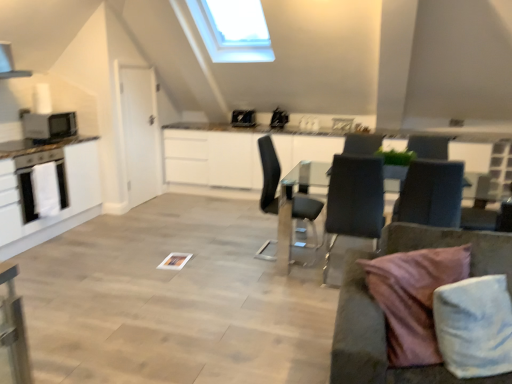
Question: Does satin black laptop at upper center, which ranks as the second appliance in back-to-front order, appear on the left side of black leather chair at center, the 1th chair viewed from the left?

Choices:
 (A) yes
 (B) no

Answer: (B)

Question: Is satin black laptop at upper center, marked as the 3th appliance in a left-to-right arrangement, behind black leather chair at center, which is the 3th chair in right-to-left order?

Choices:
 (A) no
 (B) yes

Answer: (B)

Question: Considering the relative sizes of satin black laptop at upper center, which appears as the 2th appliance when viewed from the front, and black leather chair at center, the 1th chair viewed from the left, in the image provided, is satin black laptop at upper center, which appears as the 2th appliance when viewed from the front, thinner than black leather chair at center, the 1th chair viewed from the left,?

Choices:
 (A) yes
 (B) no

Answer: (A)

Question: Is black leather chair at center, which is the 3th chair in right-to-left order, located within satin black laptop at upper center, which appears as the 2th appliance when viewed from the front?

Choices:
 (A) yes
 (B) no

Answer: (B)

Question: Considering the relative positions of satin black laptop at upper center, which appears as the 2th appliance when viewed from the front, and black leather chair at center, which is the 3th chair in right-to-left order, in the image provided, is satin black laptop at upper center, which appears as the 2th appliance when viewed from the front, in front of black leather chair at center, which is the 3th chair in right-to-left order,?

Choices:
 (A) no
 (B) yes

Answer: (A)

Question: Is satin black laptop at upper center, which ranks as the second appliance in back-to-front order, to the left or to the right of white glossy cabinetry at left in the image?

Choices:
 (A) left
 (B) right

Answer: (B)

Question: From a real-world perspective, is satin black laptop at upper center, which appears as the 2th appliance when viewed from the front, above or below white glossy cabinetry at left?

Choices:
 (A) above
 (B) below

Answer: (A)

Question: Is satin black laptop at upper center, which appears as the 2th appliance when viewed from the front, wider or thinner than white glossy cabinetry at left?

Choices:
 (A) wide
 (B) thin

Answer: (B)

Question: From the image's perspective, is satin black laptop at upper center, which appears as the 2th appliance when viewed from the front, positioned above or below white glossy cabinetry at left?

Choices:
 (A) below
 (B) above

Answer: (B)

Question: From the image's perspective, relative to white glossy oven at left, is white glossy sink at upper center above or below?

Choices:
 (A) above
 (B) below

Answer: (A)

Question: Is white glossy sink at upper center wider or thinner than white glossy oven at left?

Choices:
 (A) thin
 (B) wide

Answer: (B)

Question: From a real-world perspective, relative to white glossy oven at left, is white glossy sink at upper center vertically above or below?

Choices:
 (A) below
 (B) above

Answer: (B)

Question: Is white glossy sink at upper center inside or outside of white glossy oven at left?

Choices:
 (A) outside
 (B) inside

Answer: (A)

Question: Considering the positions of point (271, 117) and point (45, 137), is point (271, 117) closer or farther from the camera than point (45, 137)?

Choices:
 (A) farther
 (B) closer

Answer: (A)

Question: Is satin black laptop at upper center, which is the first appliance in right-to-left order, spatially inside matte black microwave at left, positioned as the 1th appliance in left-to-right order, or outside of it?

Choices:
 (A) inside
 (B) outside

Answer: (B)